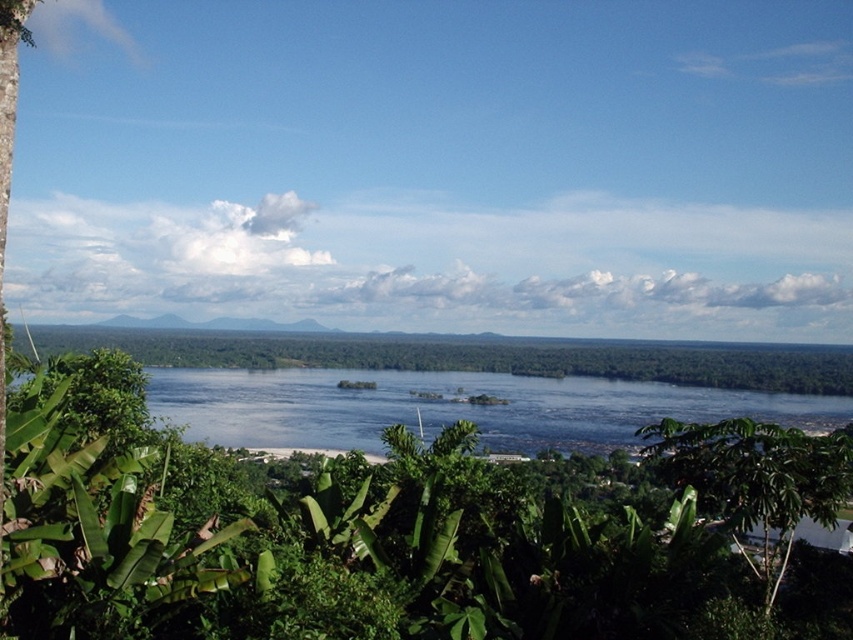
Question: Which of the following is the closest to the observer?

Choices:
 (A) transparent water at center
 (B) green leafy tree at lower right
 (C) green leafy tree at center

Answer: (B)

Question: Does green leafy tree at lower left appear over green leafy tree at center?

Choices:
 (A) yes
 (B) no

Answer: (B)

Question: Among these objects, which one is nearest to the camera?

Choices:
 (A) transparent water at center
 (B) green leafy tree at lower left
 (C) green leafy tree at lower right

Answer: (B)

Question: Is the position of transparent water at center more distant than that of green leafy tree at center?

Choices:
 (A) no
 (B) yes

Answer: (B)

Question: Estimate the real-world distances between objects in this image. Which object is closer to the green leafy tree at lower left?

Choices:
 (A) transparent water at center
 (B) green leafy tree at center

Answer: (A)

Question: Can you confirm if green leafy tree at lower left is smaller than green leafy tree at lower right?

Choices:
 (A) yes
 (B) no

Answer: (B)